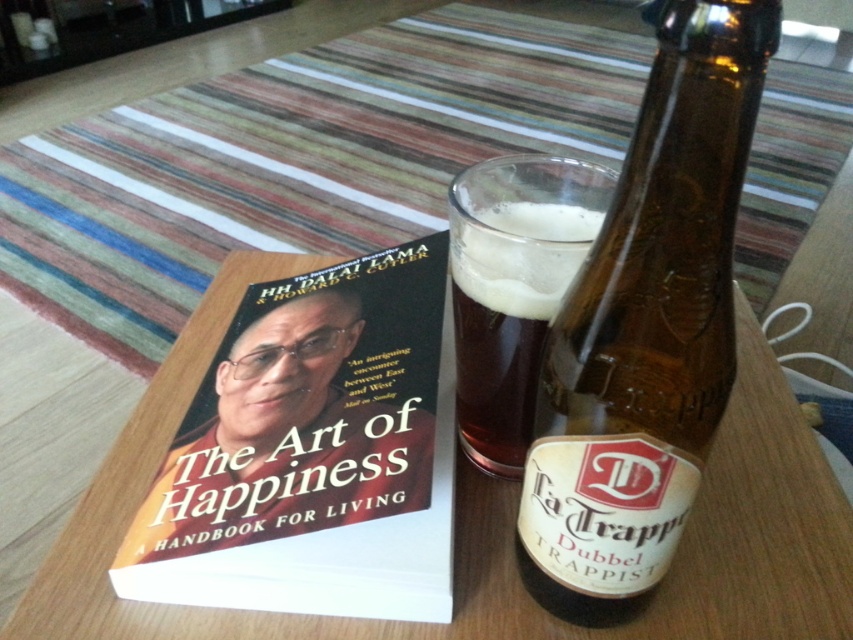
You are a guest at a dinner party and see the white paper book at center and the dark amber glass at center on the table. Which item is positioned lower on the table?

The white paper book at center is located below the dark amber glass at center, so it is positioned lower on the table.

You are standing at the position of point (x=308, y=541) and want to reach point (x=560, y=236). Which direction should you move to get there?

You should move backward to reach point (x=560, y=236) since it is behind point (x=308, y=541).